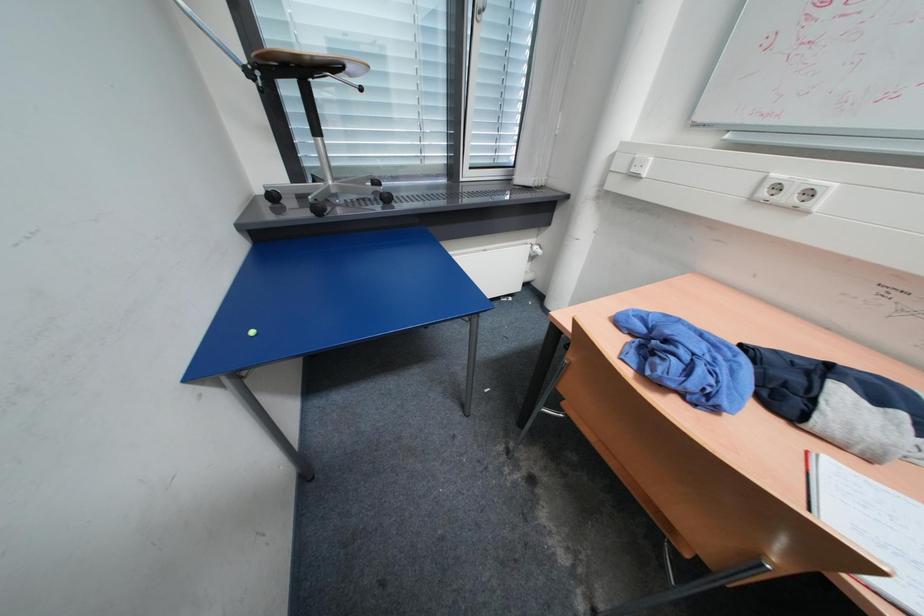
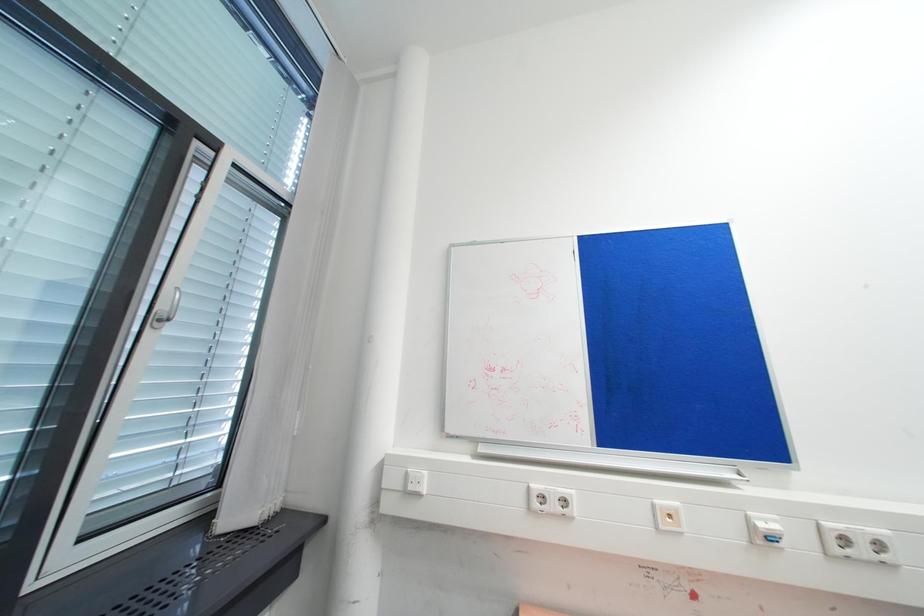
The images are taken continuously from a first-person perspective. In which direction is your viewpoint rotating?

The camera's rotation is toward right-up.